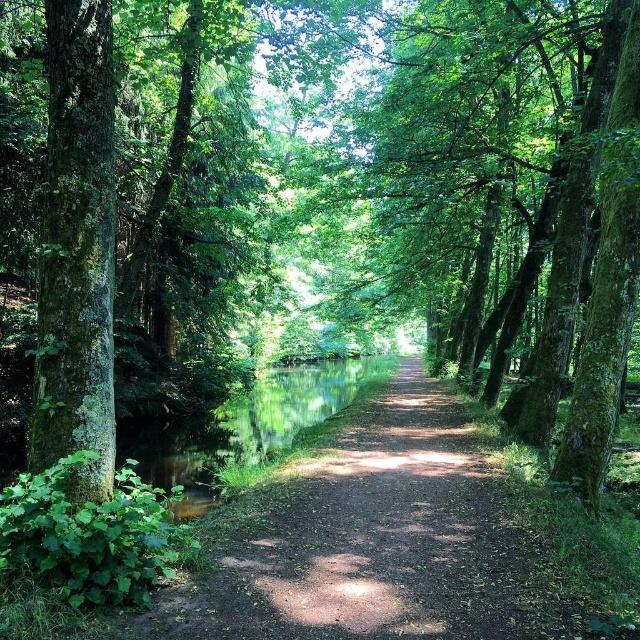
Between point (422, 490) and point (72, 156), which one is positioned in front?

Positioned in front is point (72, 156).

Is the position of dirt path at center less distant than that of green mossy tree at left?

That is True.

Does point (458, 589) come closer to viewer compared to point (74, 492)?

No.

Image resolution: width=640 pixels, height=640 pixels. Identify the location of dirt path at center. (365, 540).